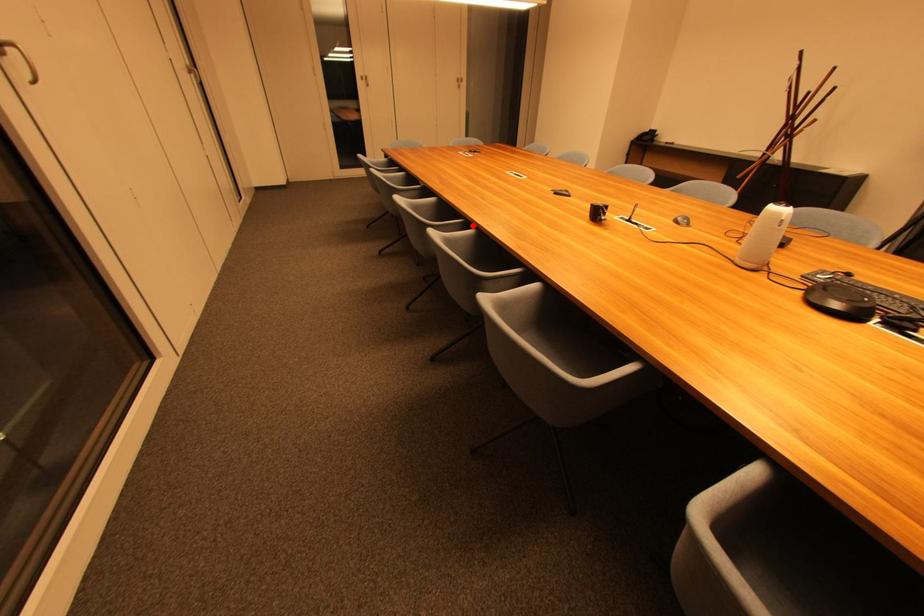
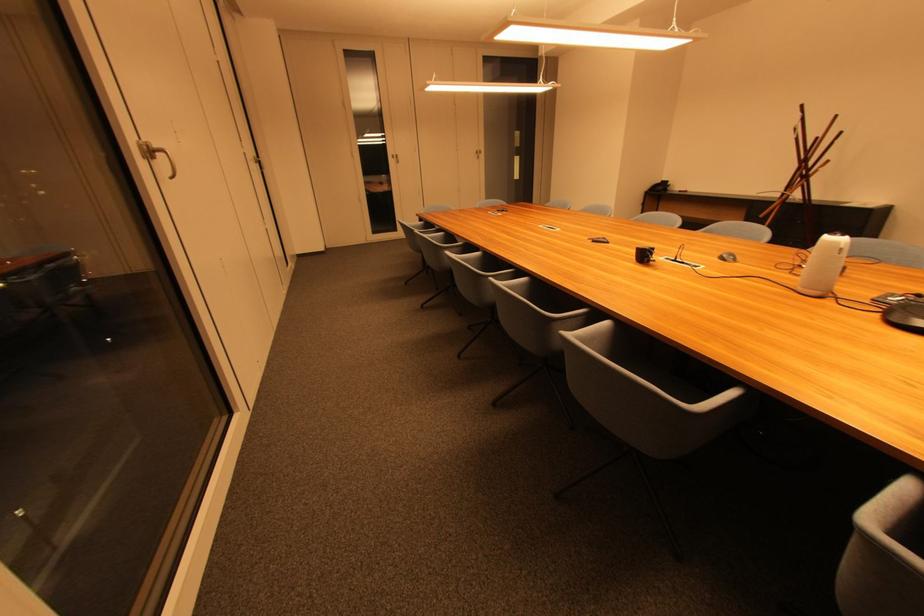
Question: I am providing you with two images of the same scene from different viewpoints. Image1 has a red point marked. In image2, the corresponding 3D location appears at what relative position? Reply with the corresponding letter.

Choices:
 (A) Closer
 (B) Farther

Answer: (B)